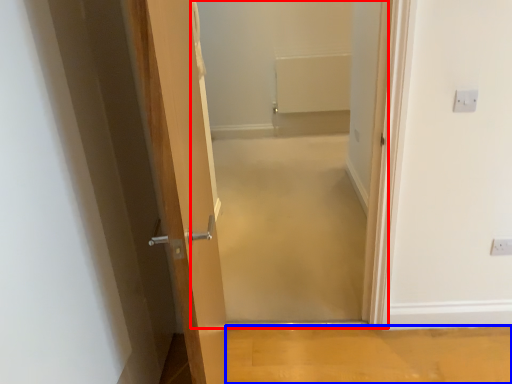
Question: Which object is further to the camera taking this photo, corridor (highlighted by a red box) or plain (highlighted by a blue box)?

Choices:
 (A) corridor
 (B) plain

Answer: (B)